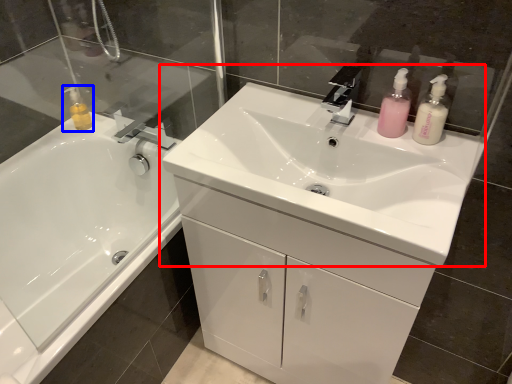
Question: Which object appears farthest to the camera in this image, sink (highlighted by a red box) or toiletry (highlighted by a blue box)?

Choices:
 (A) sink
 (B) toiletry

Answer: (B)